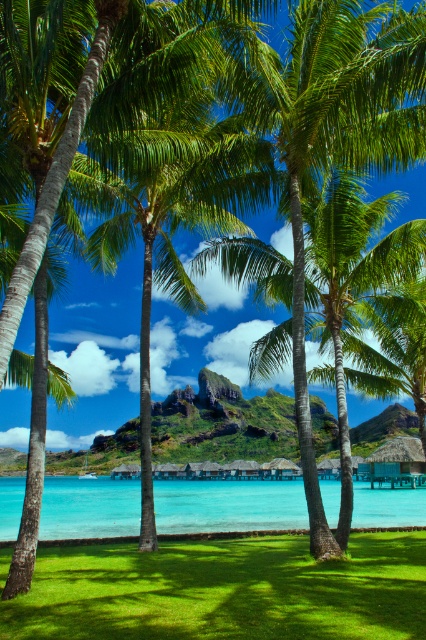
Who is higher up, green grass at lower left or clear blue water at center?

green grass at lower left is above.

Is green grass at lower left above clear blue water at center?

Indeed, green grass at lower left is positioned over clear blue water at center.

Is point (42, 563) closer to viewer compared to point (189, 500)?

Yes, it is in front of point (189, 500).

Image resolution: width=426 pixels, height=640 pixels. What are the coordinates of `green grass at lower left` in the screenshot? It's located at (224, 592).